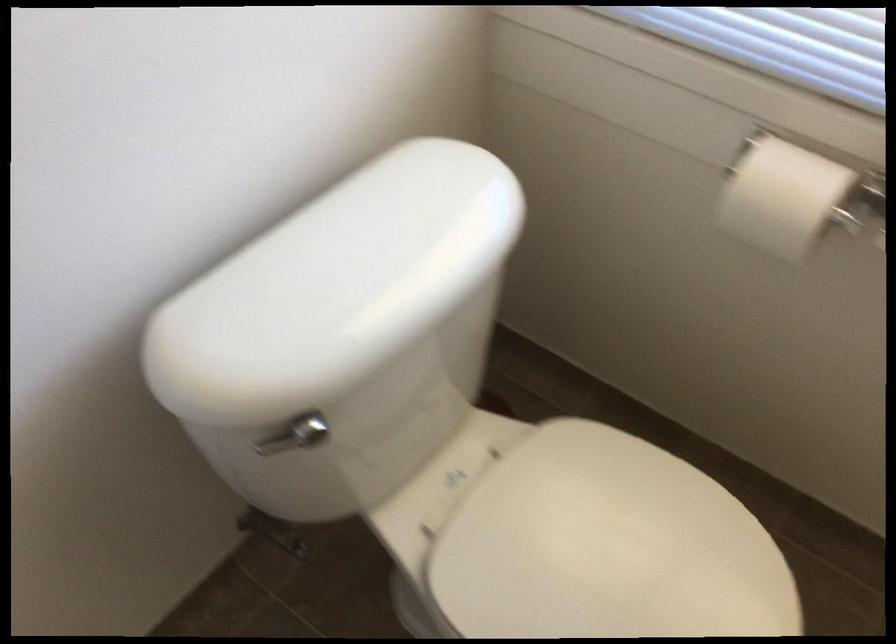
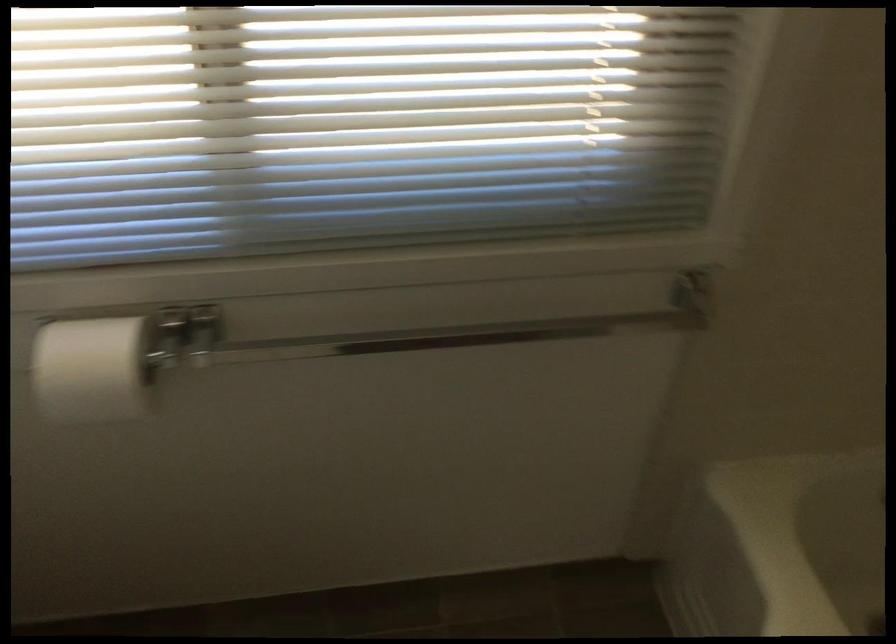
Question: The images are taken continuously from a first-person perspective. In which direction is your viewpoint rotating?

Choices:
 (A) Left
 (B) Right
 (C) Up
 (D) Down

Answer: (B)